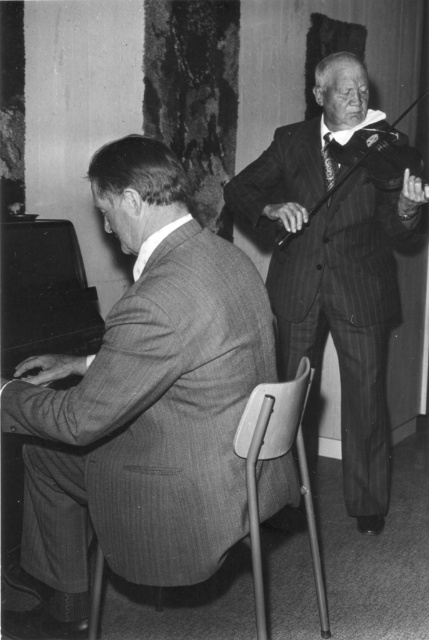
Based on the scene description, which man is closer to the observer? The striped suit at left or the pinstriped suit at right?

The striped suit at left is closer to the observer because it is in front of the pinstriped suit at right.

Based on the photo, based on the scene description, which man is positioned lower in the image? The striped suit at left or the pinstriped suit at right?

The striped suit at left is positioned lower in the image because it is described as being below the pinstriped suit at right.